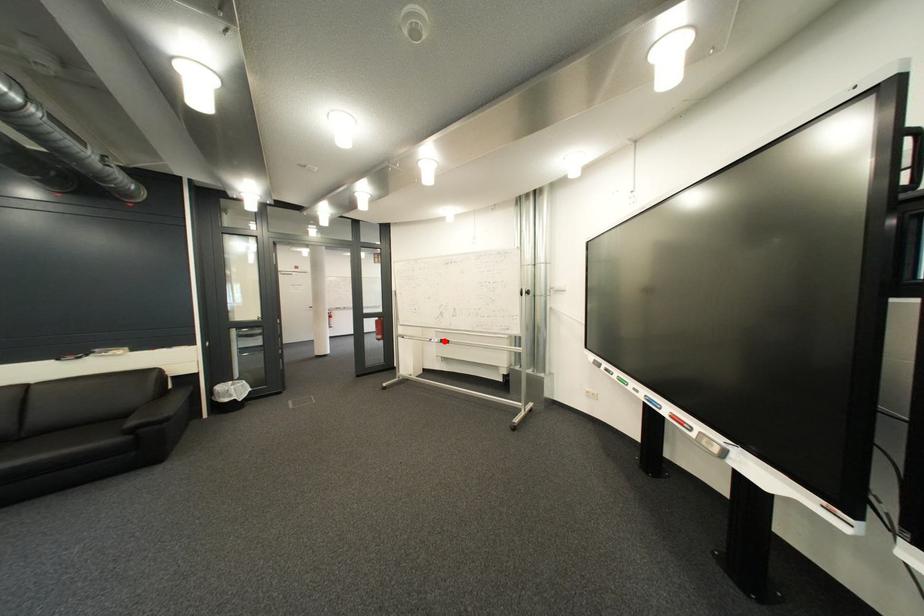
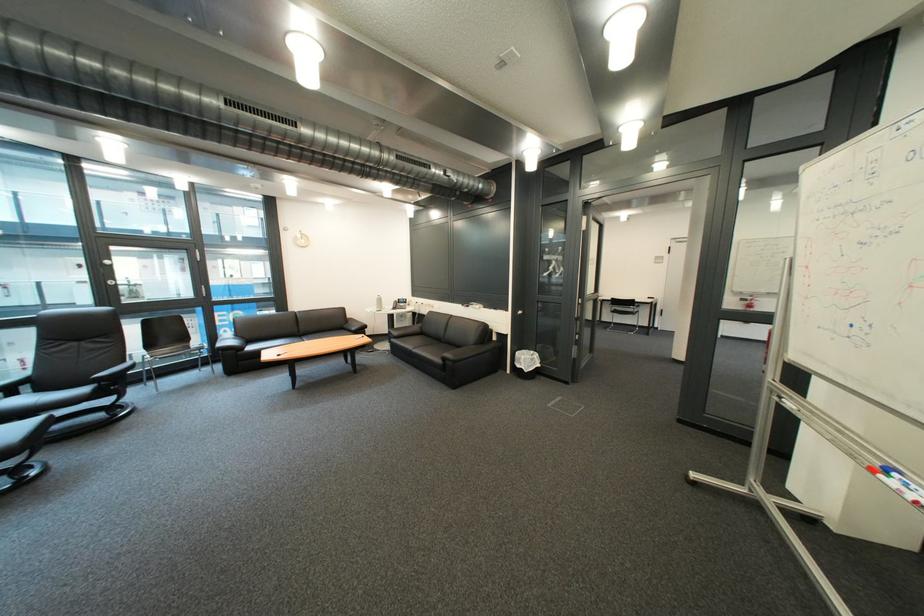
In the second image, find the point that corresponds to the highlighted location in the first image.

(901, 472)